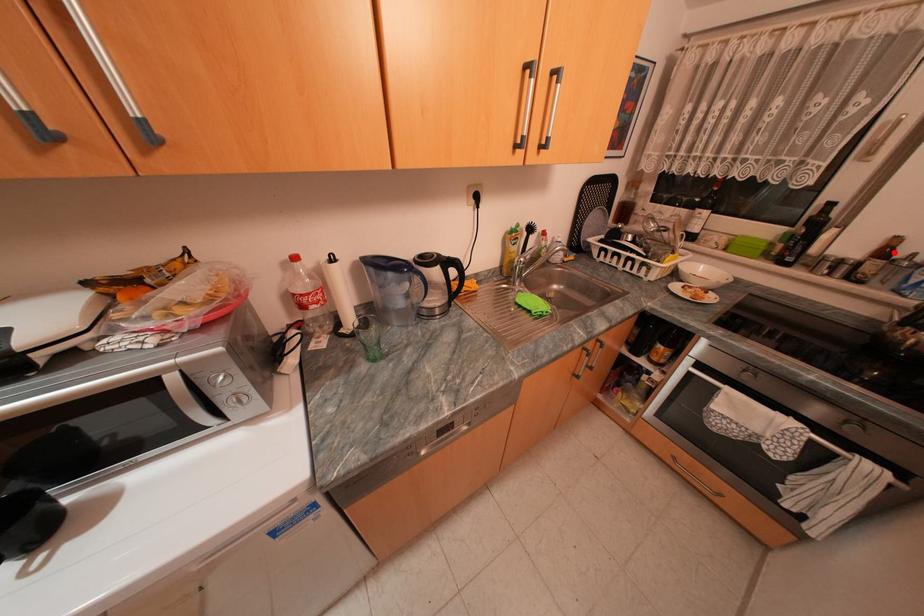
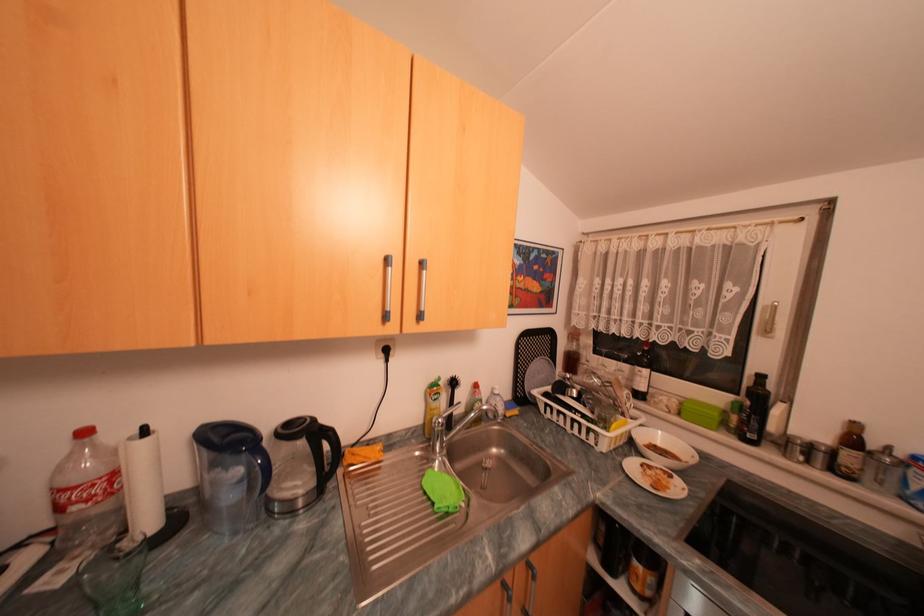
The point at the highlighted location is marked in the first image. Where is the corresponding point in the second image?

(862, 440)